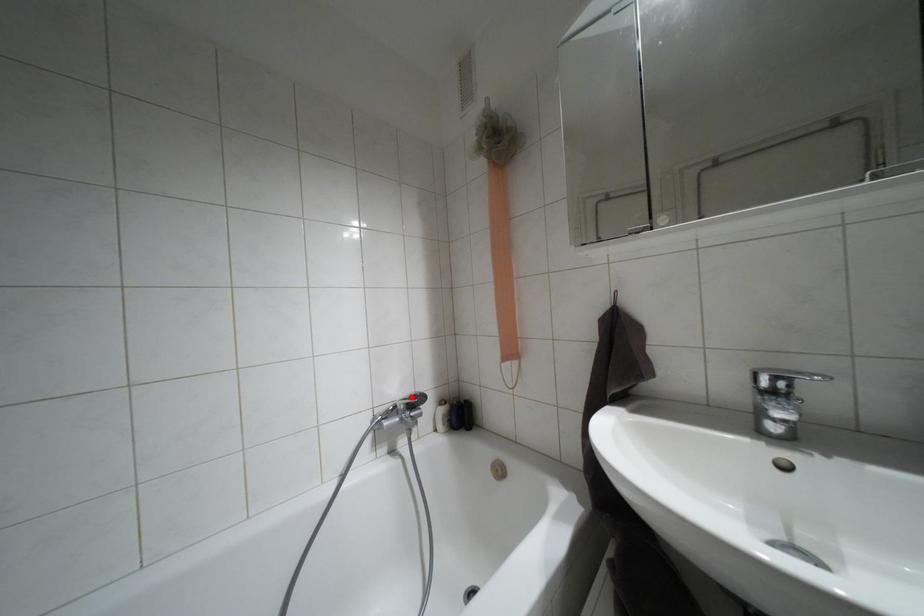
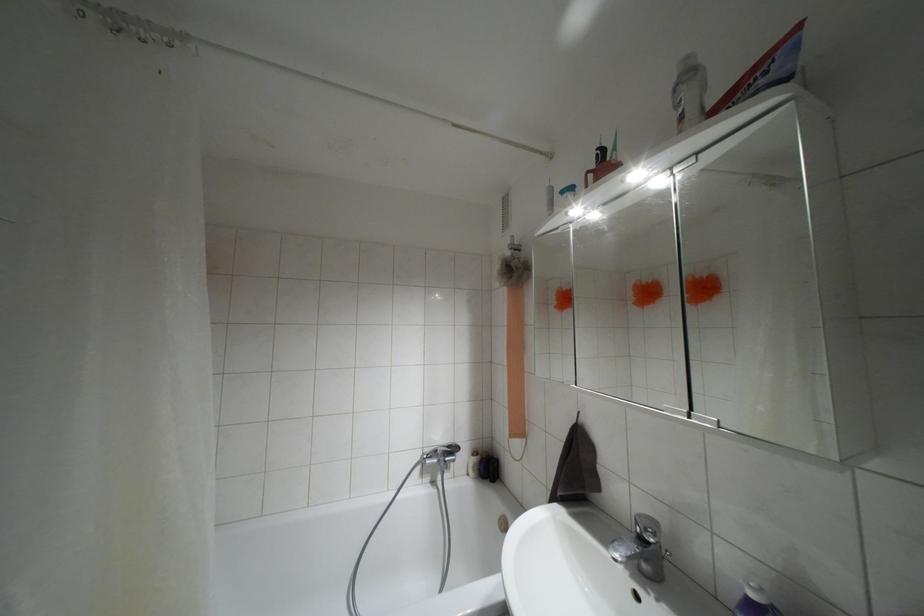
Locate, in the second image, the point that corresponds to the highlighted location in the first image.

(447, 446)